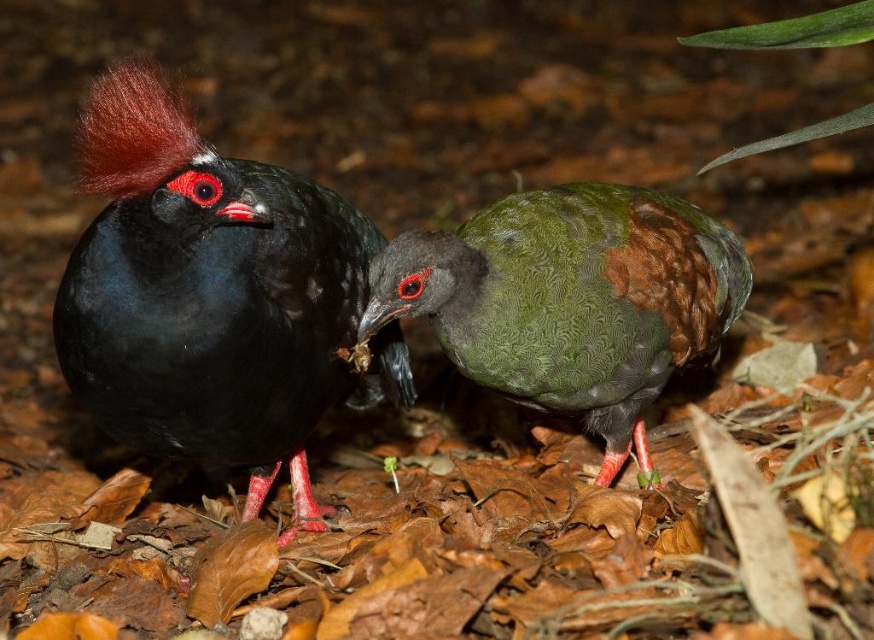
You are a nature photographer aiming to capture both the shiny black bird at left and the green textured bird at center in a single frame. Based on their positions, which bird should you focus on first to ensure both are in the shot?

Since the shiny black bird at left is to the left of the green textured bird at center, you should focus on the green textured bird at center first to ensure both birds are within the frame.